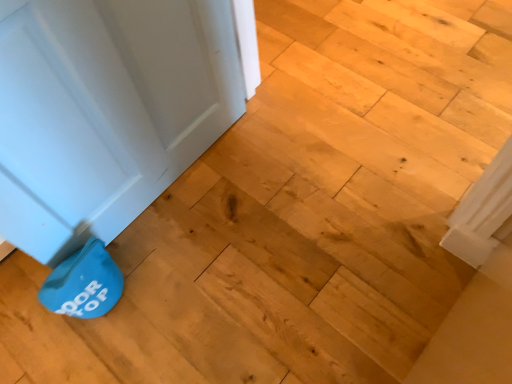
Image resolution: width=512 pixels, height=384 pixels. In order to click on matte blue door at lower left in this screenshot , I will do `click(106, 110)`.

What do you see at coordinates (106, 110) in the screenshot? I see `matte blue door at lower left` at bounding box center [106, 110].

Locate an element on the screen. The width and height of the screenshot is (512, 384). matte blue door at lower left is located at coordinates (106, 110).